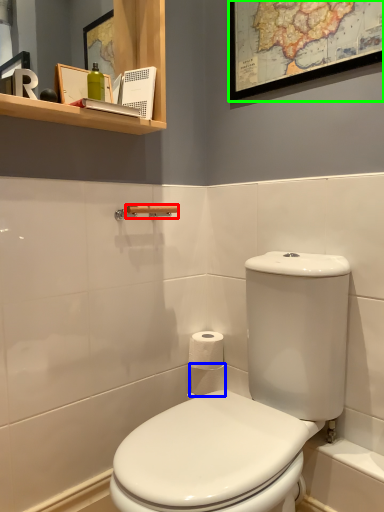
Question: Which is farther away from towel bar (highlighted by a red box)? toilet paper (highlighted by a blue box) or picture frame (highlighted by a green box)?

Choices:
 (A) toilet paper
 (B) picture frame

Answer: (B)